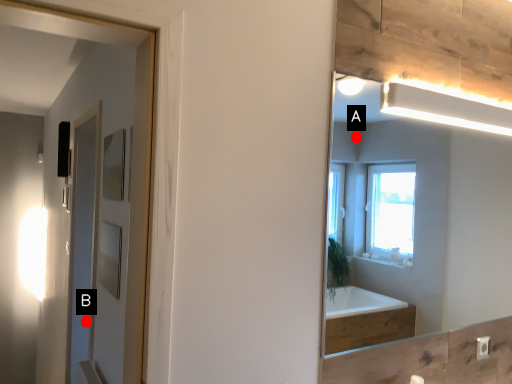
Question: Two points are circled on the image, labeled by A and B beside each circle. Which of the following is the farthest from the observer?

Choices:
 (A) A is further
 (B) B is further

Answer: (A)